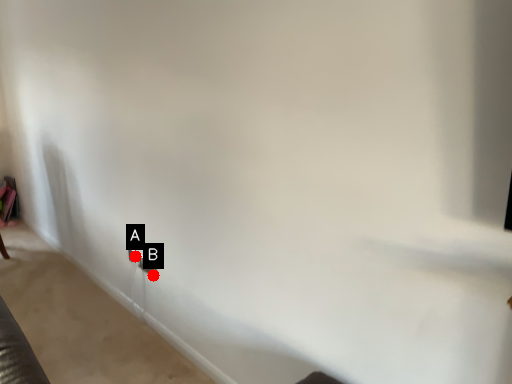
Question: Two points are circled on the image, labeled by A and B beside each circle. Which of the following is the closest to the observer?

Choices:
 (A) A is closer
 (B) B is closer

Answer: (B)